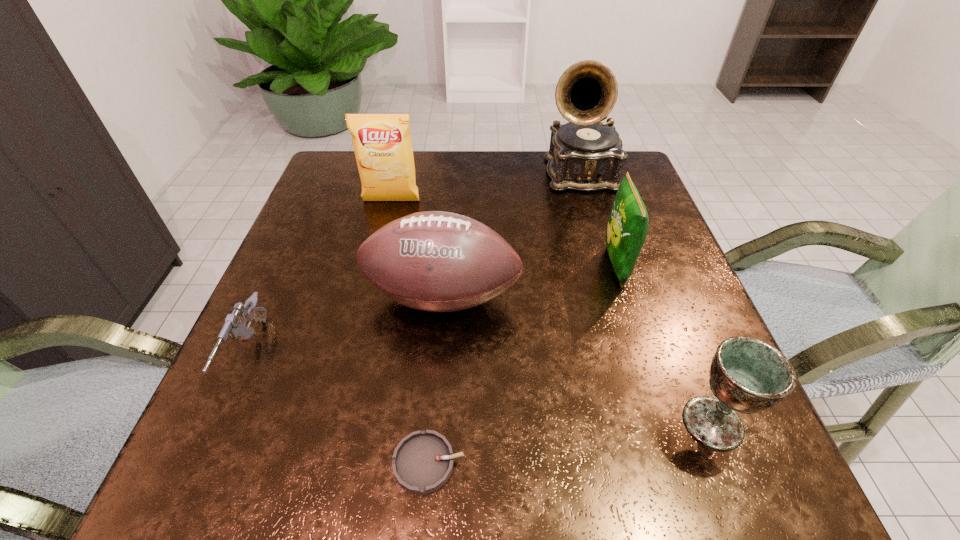
At what (x,y) coordinates should I click in order to perform the action: click on object at the near right corner. Please return your answer as a coordinate pair (x, y). Looking at the image, I should click on (747, 375).

Where is `vacant space at the far edge of the desktop`? vacant space at the far edge of the desktop is located at coordinates [x=428, y=182].

In the image, there is a desktop. At what (x,y) coordinates should I click in order to perform the action: click on vacant space at the near edge. Please return your answer as a coordinate pair (x, y). The width and height of the screenshot is (960, 540). Looking at the image, I should click on (328, 464).

In the image, there is a desktop. Where is `vacant area at the left edge`? vacant area at the left edge is located at coordinates (324, 274).

The width and height of the screenshot is (960, 540). In order to click on vacant space at the right edge of the desktop in this screenshot , I will do `click(643, 260)`.

Where is `free spot at the far left corner of the desktop`? This screenshot has height=540, width=960. free spot at the far left corner of the desktop is located at coordinates (352, 198).

The width and height of the screenshot is (960, 540). Identify the location of free space between the sixth tallest object and the shortest object. click(339, 409).

Where is `free space between the tallest object and the football (American)`? free space between the tallest object and the football (American) is located at coordinates (511, 236).

At what (x,y) coordinates should I click in order to perform the action: click on unoccupied position between the football (American) and the ashtray. Please return your answer as a coordinate pair (x, y). Looking at the image, I should click on (435, 380).

Find the location of a particular element. free space between the farther crisp (potato chip) and the leftmost object is located at coordinates (321, 278).